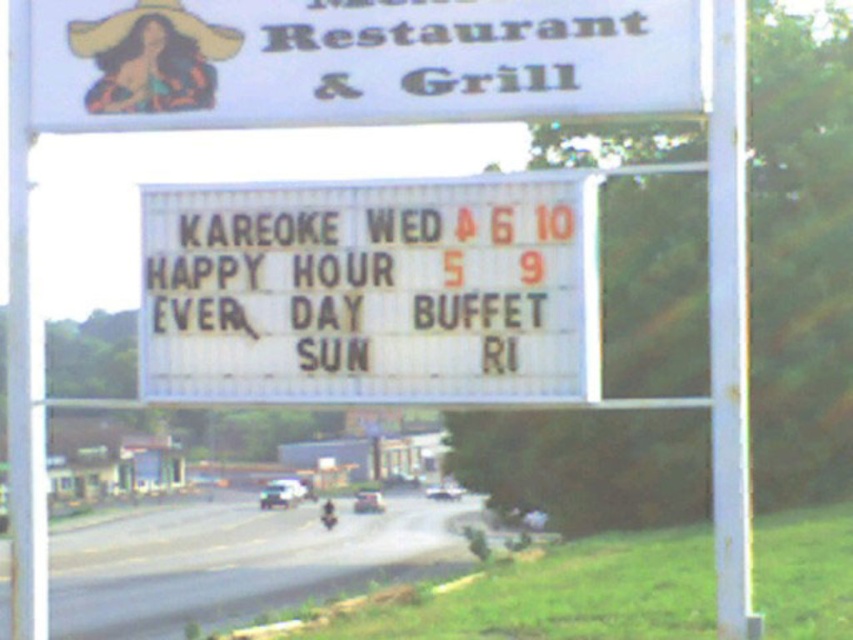
You are standing in front of the restaurant sign and want to touch both the yellow fabric cowboy hat at upper left and the metallic silver motorcycle at center. Which object can you reach first without moving your position?

You can reach the yellow fabric cowboy hat at upper left first because it is closer to you than the metallic silver motorcycle at center.